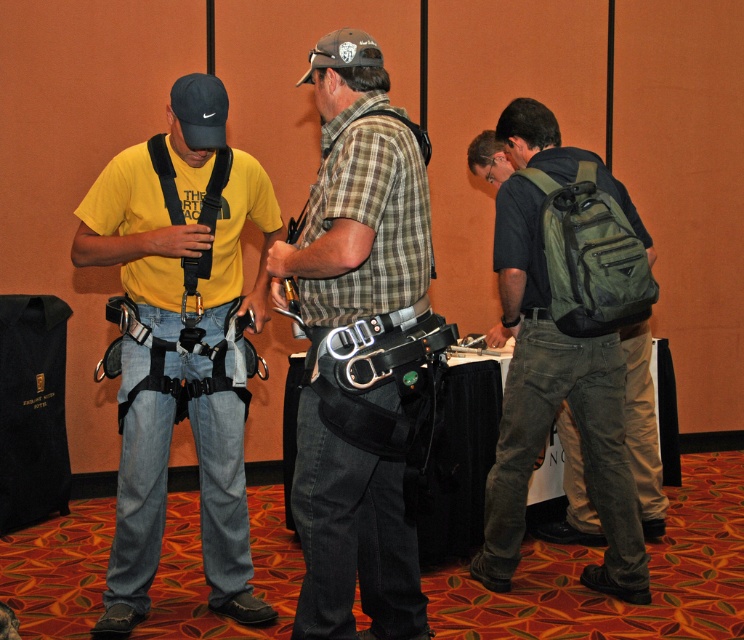
Question: Which object appears farthest from the camera in this image?

Choices:
 (A) matte black harness at center
 (B) plaid fabric shirt at center

Answer: (A)

Question: Is the position of plaid fabric shirt at center less distant than that of green canvas backpack at right?

Choices:
 (A) yes
 (B) no

Answer: (A)

Question: Does matte black harness at center appear on the right side of plaid fabric shirt at center?

Choices:
 (A) no
 (B) yes

Answer: (A)

Question: In this image, where is matte black harness at center located relative to green canvas backpack at right?

Choices:
 (A) above
 (B) below

Answer: (A)

Question: Which point appears farthest from the camera in this image?

Choices:
 (A) (359, 577)
 (B) (219, 500)

Answer: (B)

Question: Which of the following is the farthest from the observer?

Choices:
 (A) plaid fabric shirt at center
 (B) matte black harness at center

Answer: (B)